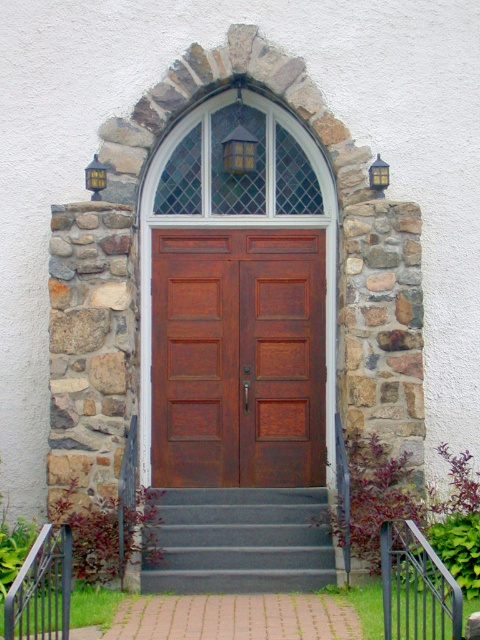
You are standing at the entrance of the building and want to go upstairs. Which direction should you move relative to the brown wooden door at center to reach the gray carpeted stairs at center?

The gray carpeted stairs at center are to the right of the brown wooden door at center, so you should move to the right of the brown wooden door at center to reach them.

You are a delivery person carrying a large package that is 1.8 meters tall. You arrive at the entrance and see the brown wooden door at center and the gray carpeted stairs at center. Can you fit the package through the entrance without tilting it?

The brown wooden door at center is smaller than the gray carpeted stairs at center. Since the package is 1.8 meters tall, it may not fit through the brown wooden door at center, but the gray carpeted stairs at center might provide enough space. However, without knowing the exact dimensions of the door and stairs, it is difficult to determine for certain.

You are standing at the entrance of the building and want to go upstairs. The gray carpeted stairs at center are your destination. Which direction should you move relative to the brown wooden door at center to reach them?

The gray carpeted stairs at center are behind the brown wooden door at center since the door is closer to you. To reach the stairs, you should move around or through the brown wooden door at center towards the center area where the stairs are located.